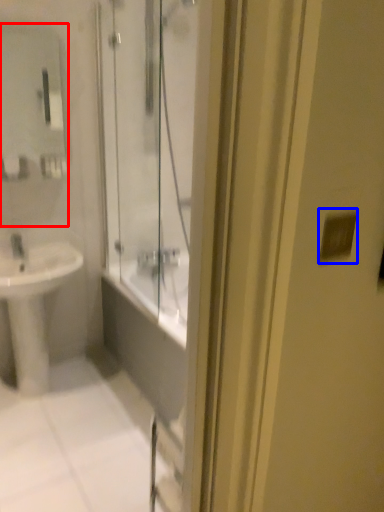
Question: Which object is closer to the camera taking this photo, mirror (highlighted by a red box) or light switch (highlighted by a blue box)?

Choices:
 (A) mirror
 (B) light switch

Answer: (B)